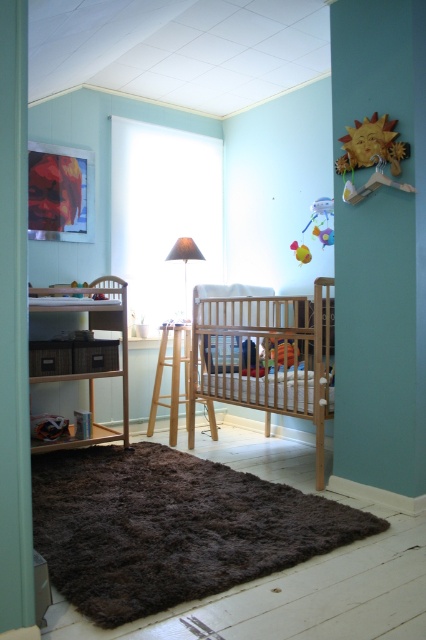
Question: Does wooden changing table at left appear over matte gray lampshade at center?

Choices:
 (A) yes
 (B) no

Answer: (B)

Question: Where is wooden sun at upper right located in relation to matte gray lampshade at center in the image?

Choices:
 (A) left
 (B) right

Answer: (B)

Question: Among these points, which one is farthest from the camera?

Choices:
 (A) (322, 240)
 (B) (57, 308)
 (C) (302, 250)

Answer: (C)

Question: Which is nearer to the light brown wooden crib at center?

Choices:
 (A) plastic multicolored toy at upper right
 (B) matte plastic toy at upper center
 (C) wooden changing table at left

Answer: (A)

Question: Which point is farther to the camera?

Choices:
 (A) (157, 392)
 (B) (288, 326)

Answer: (A)

Question: Does wooden sun at upper right have a smaller size compared to yellow rubber duck at center?

Choices:
 (A) yes
 (B) no

Answer: (B)